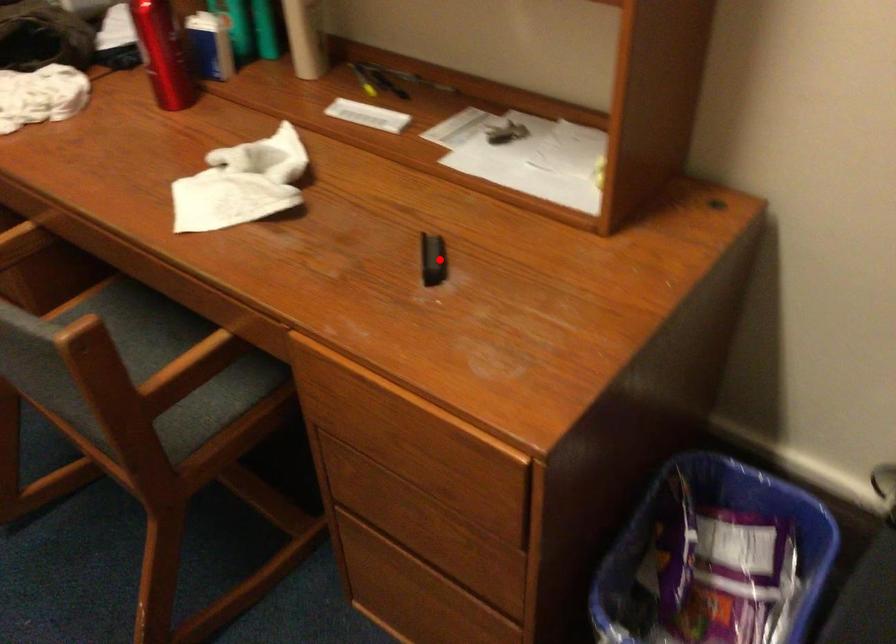
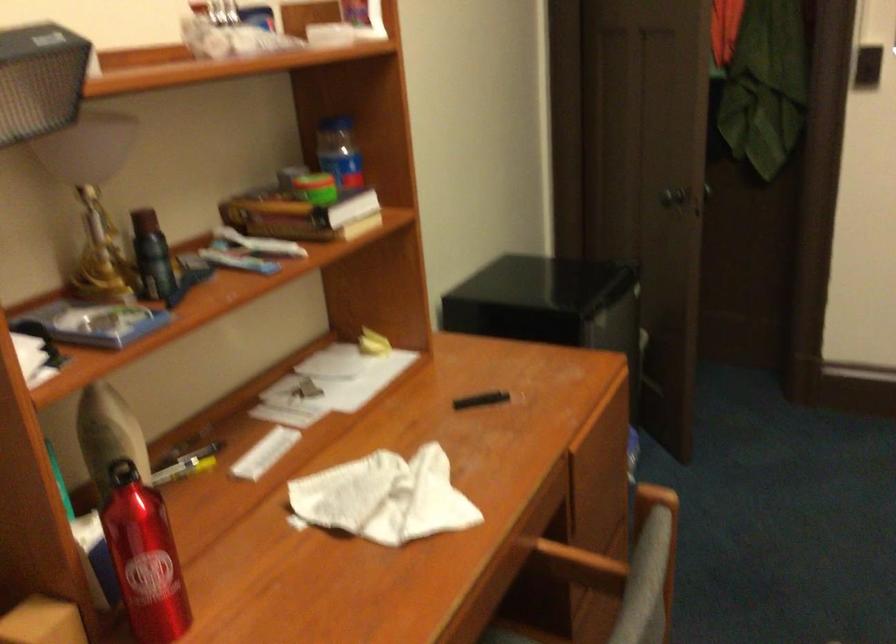
Where in the second image is the point corresponding to the highlighted location from the first image?

(480, 400)